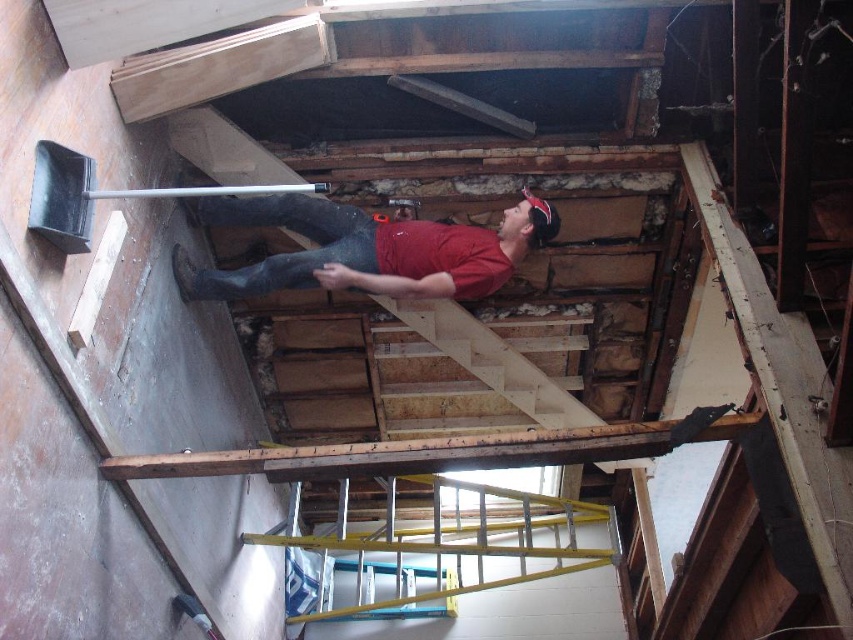
Is matte red shirt at upper center positioned before black plastic shovel at left?

Result: No, matte red shirt at upper center is further to the viewer.

Is matte red shirt at upper center smaller than black plastic shovel at left?

Actually, matte red shirt at upper center might be larger than black plastic shovel at left.

You are a GUI agent. You are given a task and a screenshot of the screen. Output one action in this format:
    pyautogui.click(x=<x>, y=<y>)
    Task: Click on the matte red shirt at upper center
    
    Given the screenshot: What is the action you would take?
    pyautogui.click(x=366, y=250)

Who is more forward, (x=492, y=524) or (x=314, y=186)?

Point (x=314, y=186) is in front.

Is yellow metallic ladder at center further to the viewer compared to black plastic shovel at left?

That is True.

Between point (602, 508) and point (74, 214), which one is positioned in front?

Point (74, 214) is in front.

Locate an element on the screen. This screenshot has height=640, width=853. yellow metallic ladder at center is located at coordinates (433, 554).

Is point (444, 589) farther from viewer compared to point (355, 288)?

Yes, it is behind point (355, 288).

Can you confirm if yellow metallic ladder at center is wider than matte red shirt at upper center?

Yes, yellow metallic ladder at center is wider than matte red shirt at upper center.

You are a GUI agent. You are given a task and a screenshot of the screen. Output one action in this format:
    pyautogui.click(x=<x>, y=<y>)
    Task: Click on the yellow metallic ladder at center
    The width and height of the screenshot is (853, 640).
    Given the screenshot: What is the action you would take?
    click(433, 554)